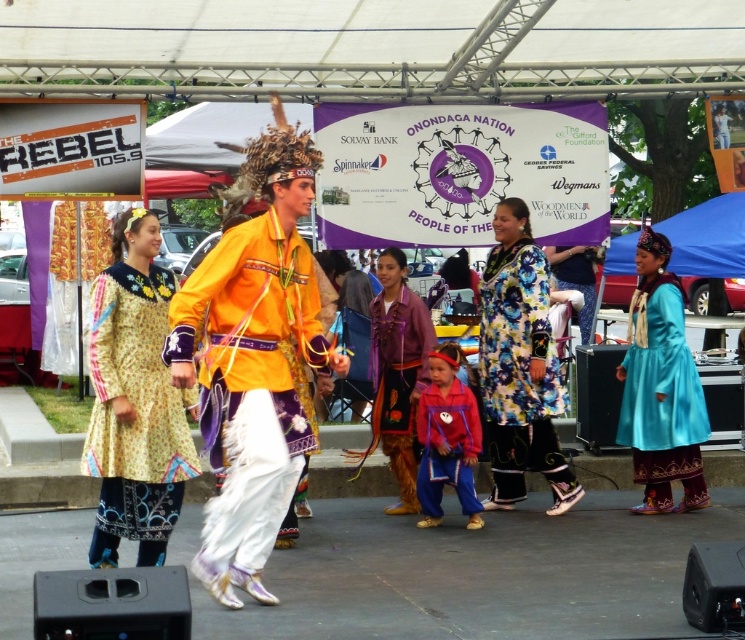
You are a photographer at the event and want to capture both the yellow floral dress at center and the matte purple dress at center in a single frame. Which dress should you focus on to ensure both are visible without zooming in or out?

The yellow floral dress at center is bigger than the matte purple dress at center, so focusing on the yellow floral dress at center will ensure both are visible without needing to adjust the zoom.

Looking at this image, you are standing at the origin point in the image. You want to move towards the yellow floral dress at center. In which direction should you move?

The yellow floral dress at center is located at point 0.627 in the x direction and 0.181 in the y direction. Since you are at the origin, you should move in the positive x and positive y directions to reach it.

You are a photographer trying to capture the vibrant outdoor event. You notice two points in your viewfinder labeled as point [235,468] and point [650,410]. Which point is nearer to your camera?

Point [235,468] is closer to the camera than point [650,410].